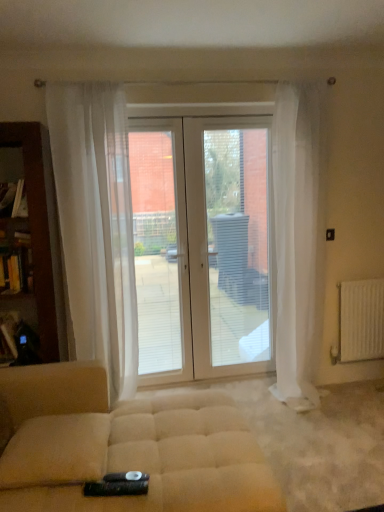
Question: Could you tell me if white metallic radiator at right is facing white plastic screen door at center?

Choices:
 (A) no
 (B) yes

Answer: (A)

Question: From the image's perspective, is white metallic radiator at right located above white plastic screen door at center?

Choices:
 (A) yes
 (B) no

Answer: (B)

Question: Is white metallic radiator at right oriented away from white plastic screen door at center?

Choices:
 (A) yes
 (B) no

Answer: (B)

Question: Is white metallic radiator at right positioned far away from white plastic screen door at center?

Choices:
 (A) no
 (B) yes

Answer: (A)

Question: Is white metallic radiator at right completely or partially outside of white plastic screen door at center?

Choices:
 (A) yes
 (B) no

Answer: (A)

Question: Does white metallic radiator at right have a greater height compared to white plastic screen door at center?

Choices:
 (A) no
 (B) yes

Answer: (A)

Question: Is white sheer curtain at right, the second curtain viewed from the left, completely or partially inside white metallic radiator at right?

Choices:
 (A) no
 (B) yes

Answer: (A)

Question: Does white metallic radiator at right have a greater width compared to white sheer curtain at right, which ranks as the 1th curtain in right-to-left order?

Choices:
 (A) no
 (B) yes

Answer: (A)

Question: Is white metallic radiator at right at the left side of white sheer curtain at right, the second curtain viewed from the left?

Choices:
 (A) yes
 (B) no

Answer: (B)

Question: Is white metallic radiator at right facing towards white sheer curtain at right, which ranks as the 1th curtain in right-to-left order?

Choices:
 (A) no
 (B) yes

Answer: (A)

Question: Is the depth of white metallic radiator at right less than that of white sheer curtain at right, the second curtain viewed from the left?

Choices:
 (A) no
 (B) yes

Answer: (A)

Question: Is white metallic radiator at right thinner than white sheer curtain at right, which ranks as the 1th curtain in right-to-left order?

Choices:
 (A) no
 (B) yes

Answer: (B)

Question: From a real-world perspective, is white glossy door at center over beige fabric ottoman at center?

Choices:
 (A) yes
 (B) no

Answer: (A)